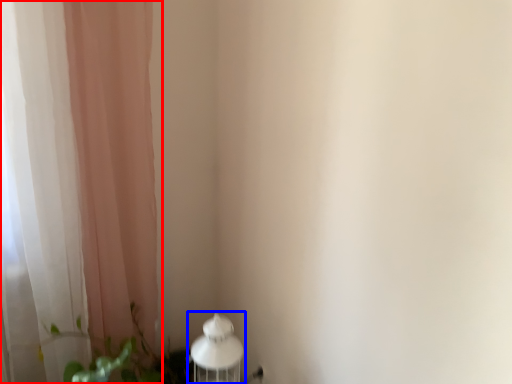
Question: Among these objects, which one is nearest to the camera, curtain (highlighted by a red box) or table lamp (highlighted by a blue box)?

Choices:
 (A) curtain
 (B) table lamp

Answer: (A)